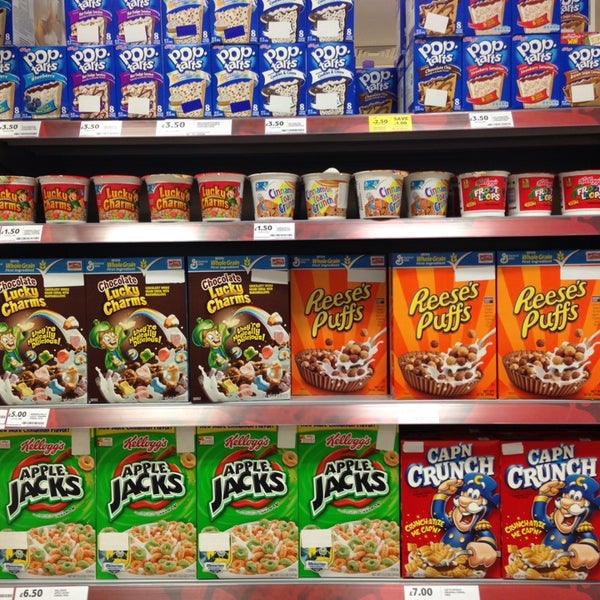
The image size is (600, 600). In order to click on cereals on lowest row in this screenshot , I will do `click(61, 519)`, `click(148, 524)`, `click(235, 480)`, `click(552, 517)`, `click(440, 511)`.